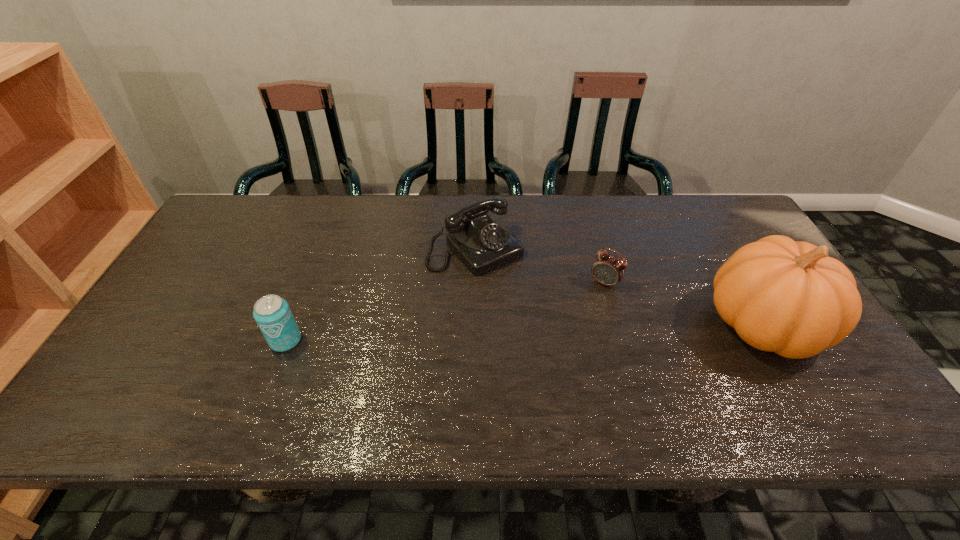
Where is `blank space located on the dial of the telephone`? blank space located on the dial of the telephone is located at coordinates (532, 305).

Find the location of a particular element. Image resolution: width=960 pixels, height=540 pixels. vacant space positioned 0.380m on the dial of the telephone is located at coordinates (589, 367).

What are the coordinates of `free spot located on the dial of the telephone` in the screenshot? It's located at (517, 289).

Locate an element on the screen. The image size is (960, 540). object located in the far edge section of the desktop is located at coordinates (482, 243).

You are a GUI agent. You are given a task and a screenshot of the screen. Output one action in this format:
    pyautogui.click(x=<x>, y=<y>)
    Task: Click on the object located at the near edge
    The image size is (960, 540).
    Given the screenshot: What is the action you would take?
    pyautogui.click(x=784, y=296)

Image resolution: width=960 pixels, height=540 pixels. In order to click on object that is at the right edge in this screenshot , I will do `click(784, 296)`.

Find the location of `object situated at the near right corner`. object situated at the near right corner is located at coordinates (784, 296).

I want to click on vacant space at the far edge of the desktop, so click(426, 214).

The width and height of the screenshot is (960, 540). Identify the location of free space at the near edge. (519, 375).

Identify the location of vacant point at the left edge. (247, 252).